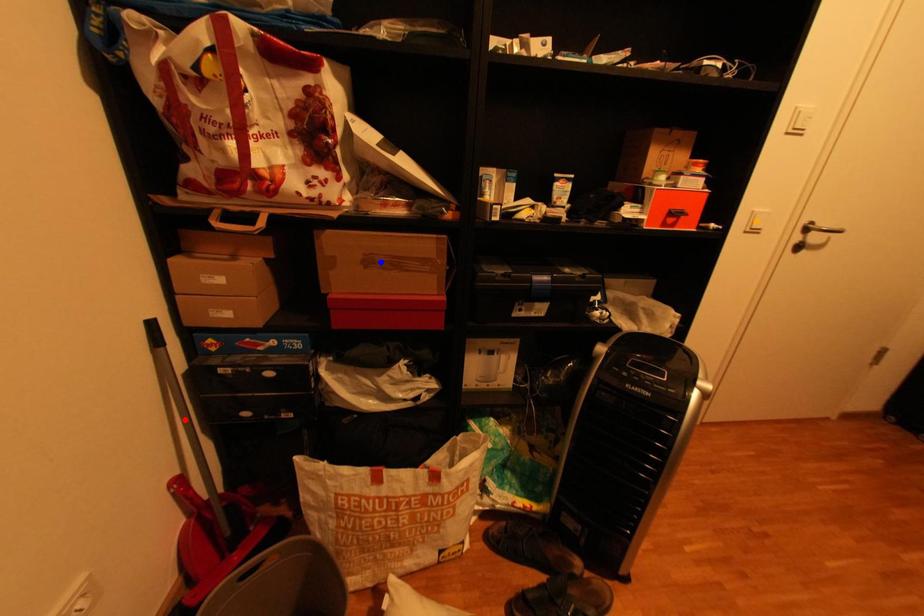
Order these from nearest to farthest:
A) orange point
B) blue point
C) red point

red point, blue point, orange point